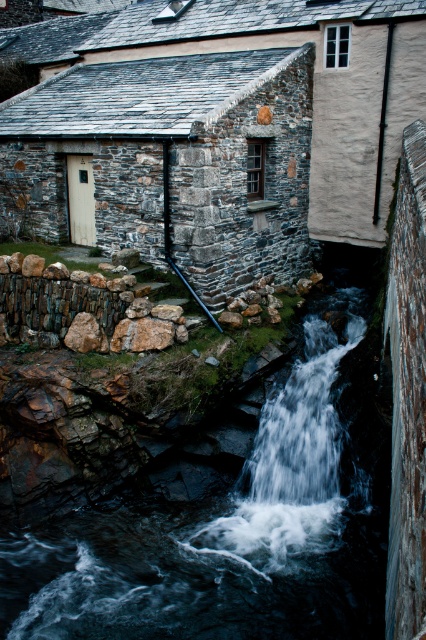
Question: Which of the following is the closest to the observer?

Choices:
 (A) translucent white water at center
 (B) rocky stone waterfall at center

Answer: (B)

Question: Which point is farther to the camera?

Choices:
 (A) translucent white water at center
 (B) rocky stone waterfall at center

Answer: (A)

Question: Can you confirm if rocky stone waterfall at center is positioned above translucent white water at center?

Choices:
 (A) yes
 (B) no

Answer: (B)

Question: Does rocky stone waterfall at center have a larger size compared to translucent white water at center?

Choices:
 (A) yes
 (B) no

Answer: (B)

Question: Is rocky stone waterfall at center above translucent white water at center?

Choices:
 (A) no
 (B) yes

Answer: (A)